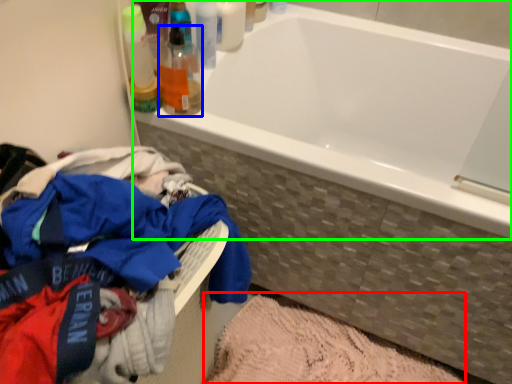
Question: Which object is the closest to the bath mat (highlighted by a red box)? Choose among these: toiletry (highlighted by a blue box) or bathtub (highlighted by a green box).

Choices:
 (A) toiletry
 (B) bathtub

Answer: (B)